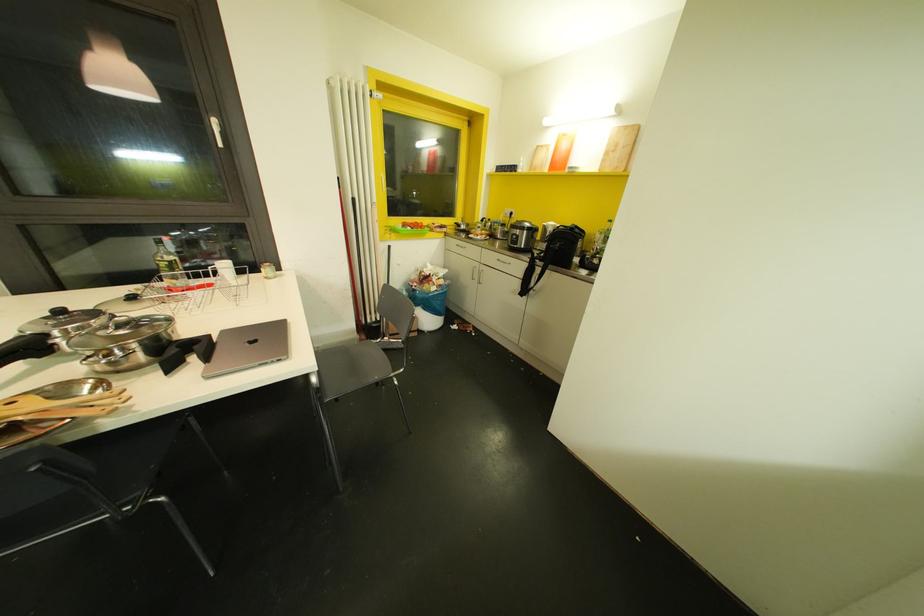
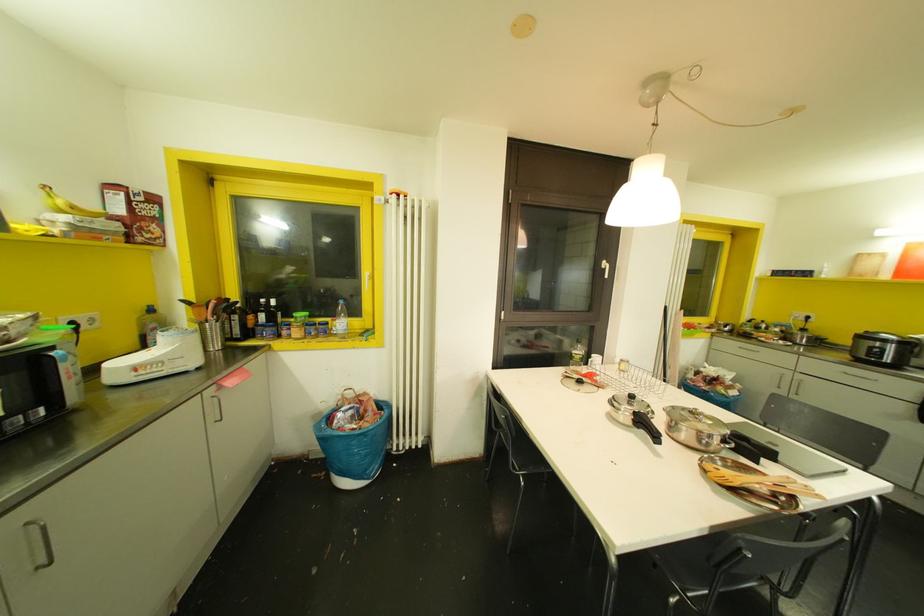
Find the pixel in the second image that matches [220,145] in the first image.

(605, 276)